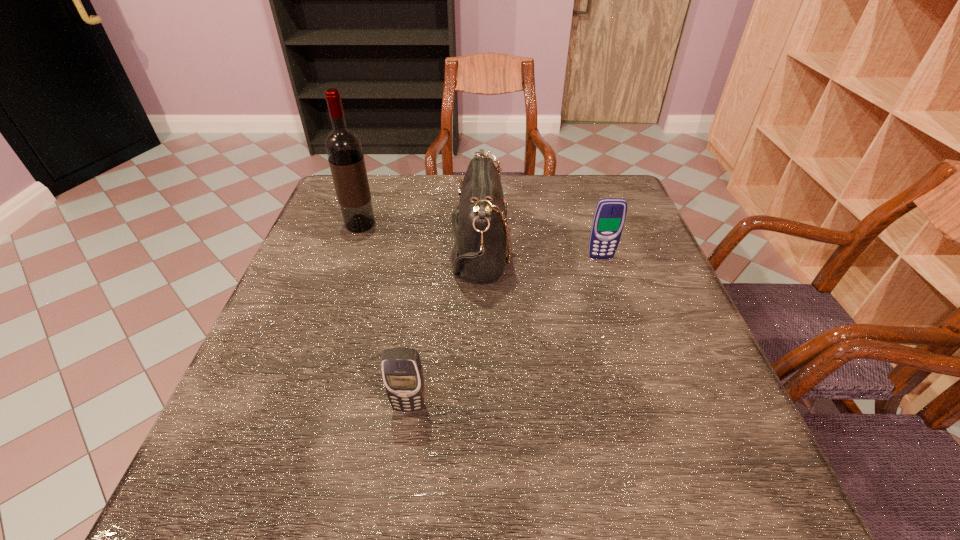
Where is `the tallest object`? This screenshot has height=540, width=960. the tallest object is located at coordinates (343, 147).

Locate an element on the screen. wine bottle is located at coordinates (343, 147).

Identify the location of the third object from left to right. (481, 235).

This screenshot has height=540, width=960. I want to click on the third shortest object, so click(x=481, y=235).

At what (x,y) coordinates should I click in order to perform the action: click on the rightmost object. Please return your answer as a coordinate pair (x, y). This screenshot has width=960, height=540. Looking at the image, I should click on (609, 218).

This screenshot has width=960, height=540. Find the location of `the right cellular telephone`. the right cellular telephone is located at coordinates (609, 218).

Where is `the third object from right to left`? The image size is (960, 540). the third object from right to left is located at coordinates (402, 372).

This screenshot has width=960, height=540. Find the location of `the nearest object`. the nearest object is located at coordinates (402, 372).

Where is `free space located 0.150m on the back of the wine bottle`? The width and height of the screenshot is (960, 540). free space located 0.150m on the back of the wine bottle is located at coordinates (373, 188).

Image resolution: width=960 pixels, height=540 pixels. I want to click on vacant space located at the front of the second tallest object with chain and zipper, so click(x=593, y=249).